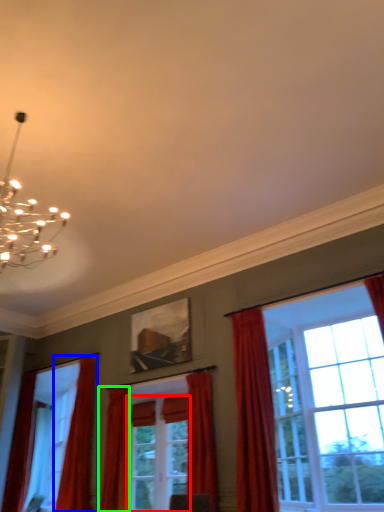
Question: Based on their relative distances, which object is nearer to screen door (highlighted by a red box)? Choose from curtain (highlighted by a blue box) and curtain (highlighted by a green box).

Choices:
 (A) curtain
 (B) curtain

Answer: (B)